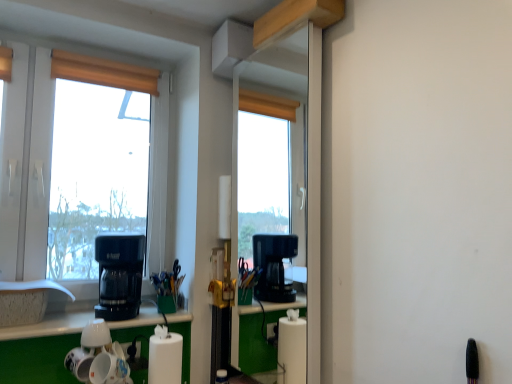
Question: Is white glossy mugs at lower left far away from white glossy counter top at lower center?

Choices:
 (A) no
 (B) yes

Answer: (A)

Question: Would you say white glossy mugs at lower left is outside white glossy counter top at lower center?

Choices:
 (A) no
 (B) yes

Answer: (B)

Question: Is white glossy mugs at lower left positioned in front of white glossy counter top at lower center?

Choices:
 (A) yes
 (B) no

Answer: (A)

Question: From a real-world perspective, is white glossy mugs at lower left over white glossy counter top at lower center?

Choices:
 (A) no
 (B) yes

Answer: (A)

Question: Considering the relative sizes of white glossy mugs at lower left and white glossy counter top at lower center in the image provided, is white glossy mugs at lower left shorter than white glossy counter top at lower center?

Choices:
 (A) no
 (B) yes

Answer: (A)

Question: From a real-world perspective, is black plastic coffee maker at left positioned above or below white plastic window at left?

Choices:
 (A) above
 (B) below

Answer: (B)

Question: From their relative heights in the image, would you say black plastic coffee maker at left is taller or shorter than white plastic window at left?

Choices:
 (A) short
 (B) tall

Answer: (A)

Question: From the image's perspective, is black plastic coffee maker at left above or below white plastic window at left?

Choices:
 (A) below
 (B) above

Answer: (A)

Question: Considering the positions of point (128, 236) and point (47, 89), is point (128, 236) closer or farther from the camera than point (47, 89)?

Choices:
 (A) farther
 (B) closer

Answer: (B)

Question: Is point (32, 240) positioned closer to the camera than point (102, 354)?

Choices:
 (A) farther
 (B) closer

Answer: (A)

Question: Is white plastic window at left in front of or behind white glossy mugs at lower left in the image?

Choices:
 (A) front
 (B) behind

Answer: (B)

Question: From the image's perspective, relative to white glossy mugs at lower left, is white plastic window at left above or below?

Choices:
 (A) above
 (B) below

Answer: (A)

Question: Considering the positions of white plastic window at left and white glossy mugs at lower left in the image, is white plastic window at left wider or thinner than white glossy mugs at lower left?

Choices:
 (A) wide
 (B) thin

Answer: (B)

Question: From their relative heights in the image, would you say white glossy counter top at lower center is taller or shorter than wooden blind at upper left?

Choices:
 (A) short
 (B) tall

Answer: (A)

Question: From a real-world perspective, is white glossy counter top at lower center above or below wooden blind at upper left?

Choices:
 (A) above
 (B) below

Answer: (B)